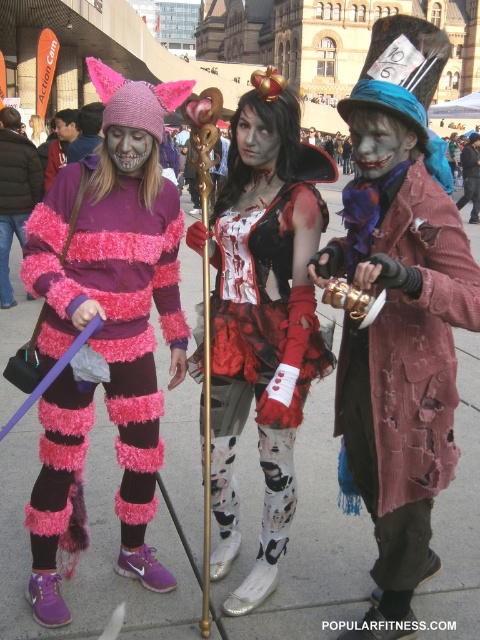
Question: Which point is closer to the camera?

Choices:
 (A) (54, 316)
 (B) (403, 195)
 (C) (19, 204)
 (D) (66, 122)

Answer: (B)

Question: Can you confirm if fuzzy pink and purple striped sweater at left is positioned to the right of matte black face paint at center?

Choices:
 (A) yes
 (B) no

Answer: (A)

Question: Does fuzzy pink and purple striped sweater at left have a smaller size compared to matte black face paint at center?

Choices:
 (A) no
 (B) yes

Answer: (A)

Question: Which is nearer to the matte black dress at center?

Choices:
 (A) rusty metal teapot at center
 (B) fuzzy pink and purple striped sweater at left
 (C) matte black face paint at center

Answer: (A)

Question: Can you confirm if rusty metal teapot at center is positioned to the right of matte black face paint at center?

Choices:
 (A) no
 (B) yes

Answer: (B)

Question: Based on their relative distances, which object is nearer to the rusty metal teapot at center?

Choices:
 (A) pink fuzzy costume at center
 (B) fuzzy pink and purple striped sweater at left
 (C) matte black dress at center

Answer: (C)